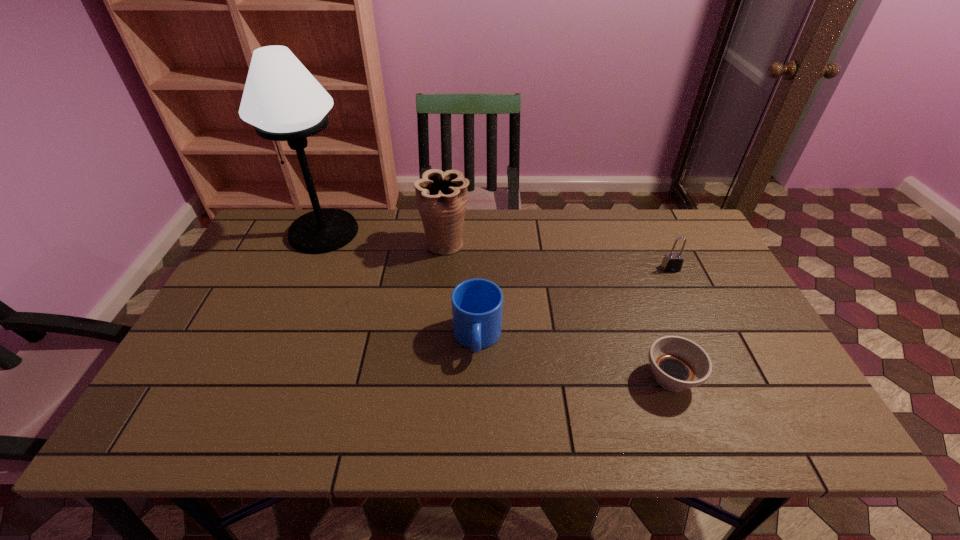
At what (x,y) coordinates should I click in order to perform the action: click on the tallest object. Please return your answer as a coordinate pair (x, y). This screenshot has height=540, width=960. Looking at the image, I should click on (281, 98).

Where is `table lamp`? Image resolution: width=960 pixels, height=540 pixels. table lamp is located at coordinates (281, 98).

Locate an element on the screen. urn is located at coordinates (441, 197).

You are a GUI agent. You are given a task and a screenshot of the screen. Output one action in this format:
    pyautogui.click(x=<x>, y=<y>)
    Task: Click on the mug
    The image size is (960, 540).
    Given the screenshot: What is the action you would take?
    pyautogui.click(x=477, y=304)

The height and width of the screenshot is (540, 960). I want to click on the third nearest object, so click(672, 262).

What are the coordinates of `the rightmost object` in the screenshot? It's located at (672, 262).

Identify the location of soup bowl. The width and height of the screenshot is (960, 540). (678, 363).

This screenshot has width=960, height=540. In order to click on the fourth object from left to right in this screenshot , I will do `click(678, 363)`.

This screenshot has width=960, height=540. Find the location of `vacant space located 0.300m on the right of the leftmost object`. vacant space located 0.300m on the right of the leftmost object is located at coordinates (452, 232).

You are a GUI agent. You are given a task and a screenshot of the screen. Output one action in this format:
    pyautogui.click(x=<x>, y=<y>)
    Task: Click on the blank area located 0.330m on the right of the second tallest object
    This screenshot has width=960, height=540.
    Given the screenshot: What is the action you would take?
    pyautogui.click(x=574, y=244)